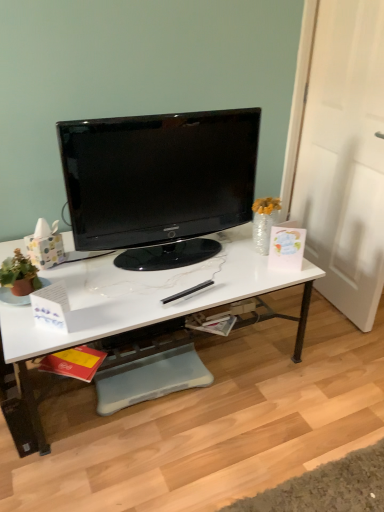
Question: From the image's perspective, is white marble desk at center on top of black glossy television at center?

Choices:
 (A) yes
 (B) no

Answer: (B)

Question: From the image's perspective, is white marble desk at center under black glossy television at center?

Choices:
 (A) no
 (B) yes

Answer: (B)

Question: Is white marble desk at center taller than black glossy television at center?

Choices:
 (A) yes
 (B) no

Answer: (B)

Question: Is white marble desk at center oriented away from black glossy television at center?

Choices:
 (A) no
 (B) yes

Answer: (A)

Question: Would you say white marble desk at center contains black glossy television at center?

Choices:
 (A) no
 (B) yes

Answer: (A)

Question: Considering the relative sizes of white marble desk at center and black glossy television at center in the image provided, is white marble desk at center thinner than black glossy television at center?

Choices:
 (A) no
 (B) yes

Answer: (A)

Question: Is the position of black glossy television at center less distant than that of white marble desk at center?

Choices:
 (A) yes
 (B) no

Answer: (B)

Question: From a real-world perspective, is black glossy television at center below white marble desk at center?

Choices:
 (A) yes
 (B) no

Answer: (B)

Question: Can you confirm if black glossy television at center is shorter than white marble desk at center?

Choices:
 (A) yes
 (B) no

Answer: (B)

Question: Can you confirm if black glossy television at center is positioned to the right of white marble desk at center?

Choices:
 (A) no
 (B) yes

Answer: (B)

Question: Considering the relative sizes of black glossy television at center and white marble desk at center in the image provided, is black glossy television at center thinner than white marble desk at center?

Choices:
 (A) yes
 (B) no

Answer: (A)

Question: Can you confirm if black glossy television at center is bigger than white marble desk at center?

Choices:
 (A) no
 (B) yes

Answer: (A)

Question: Relative to white marble desk at center, is black glossy television at center in front or behind?

Choices:
 (A) behind
 (B) front

Answer: (A)